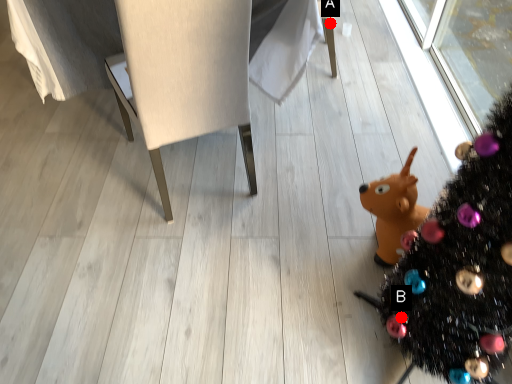
Question: Two points are circled on the image, labeled by A and B beside each circle. Which point is farther to the camera?

Choices:
 (A) A is further
 (B) B is further

Answer: (A)